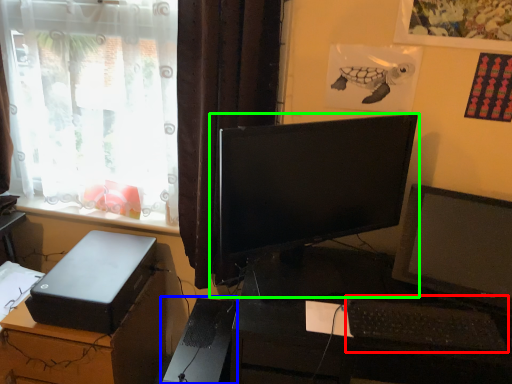
Question: Which object is positioned farthest from computer keyboard (highlighted by a red box)? Select from computer tower (highlighted by a blue box) and computer monitor (highlighted by a green box).

Choices:
 (A) computer tower
 (B) computer monitor

Answer: (A)